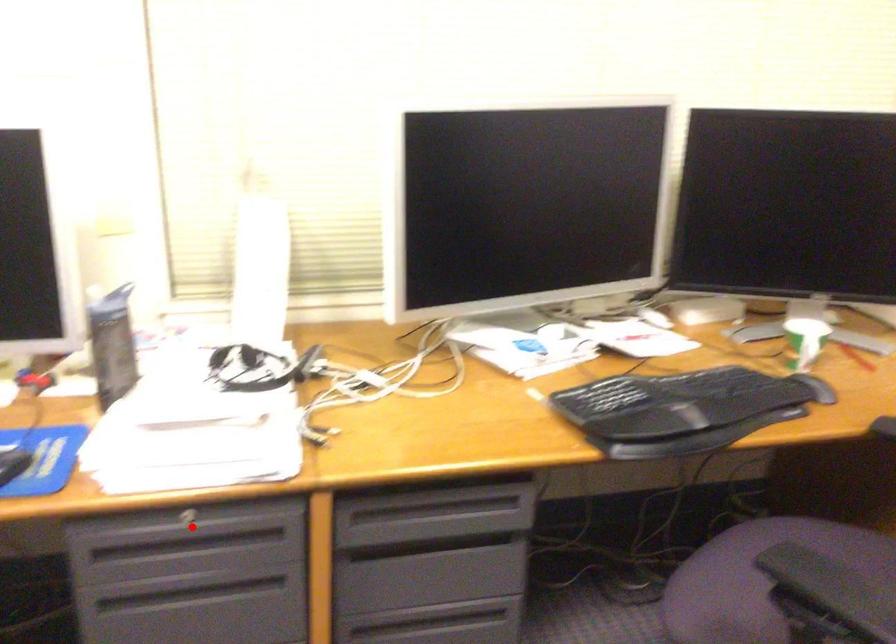
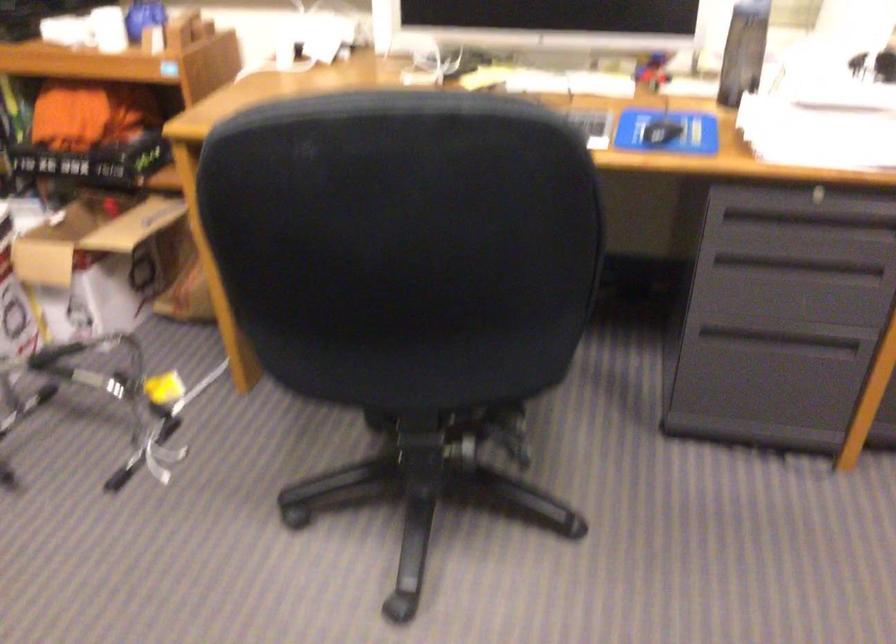
Find the pixel in the second image that matches the highlighted location in the first image.

(817, 196)